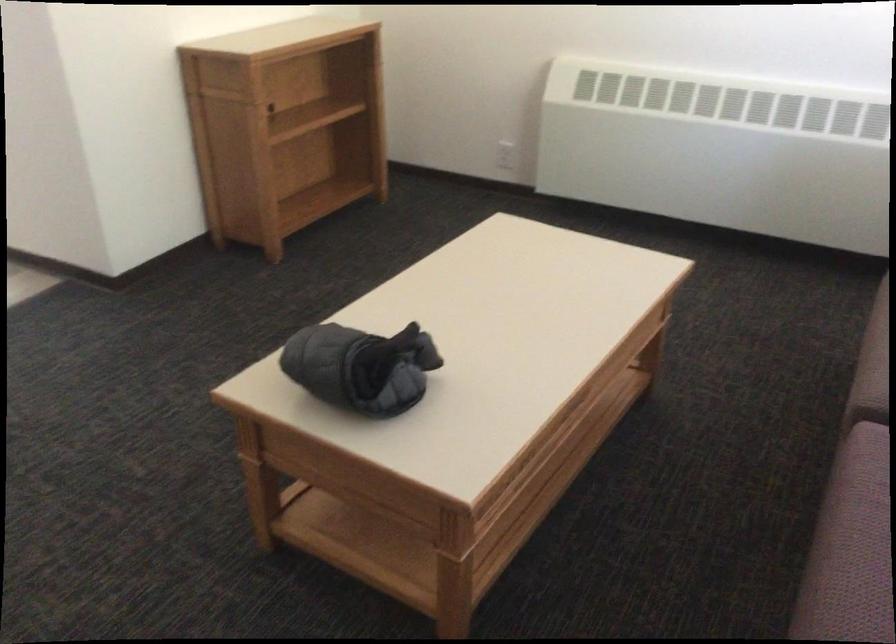
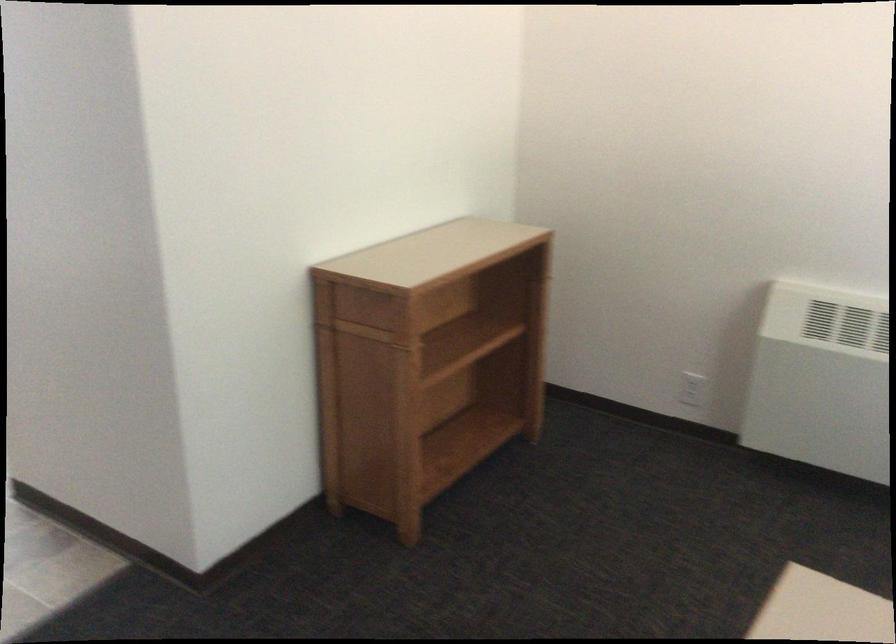
Find the pixel in the second image that matches pixel 313 115 in the first image.

(462, 345)